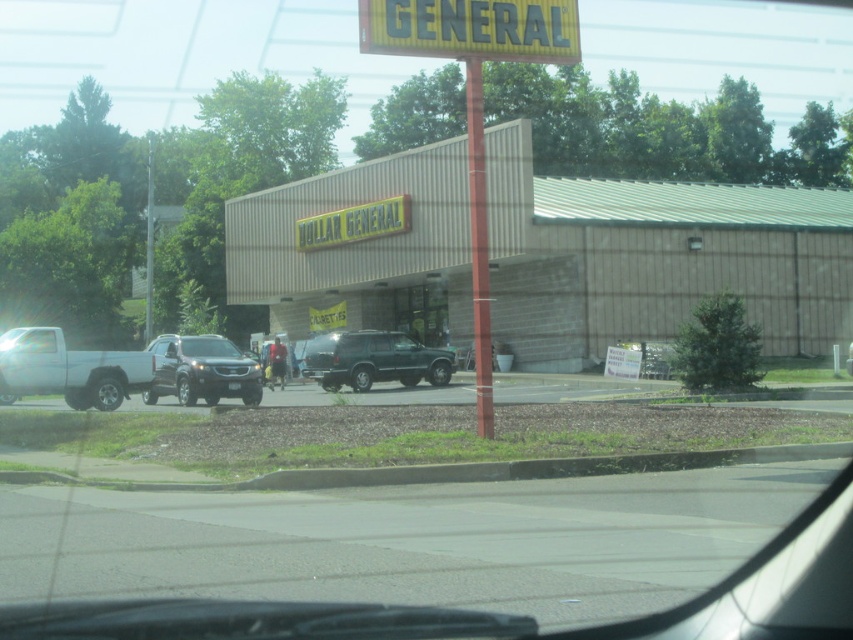
You are driving a car and want to park in the parking spot in front of the Dollar General store. There is a metallic green suv at center and a satin black suv at center already parked there. Which vehicle would require more space to move out of the parking spot?

The satin black suv at center requires more space to move out of the parking spot because it has a larger size compared to the metallic green suv at center.